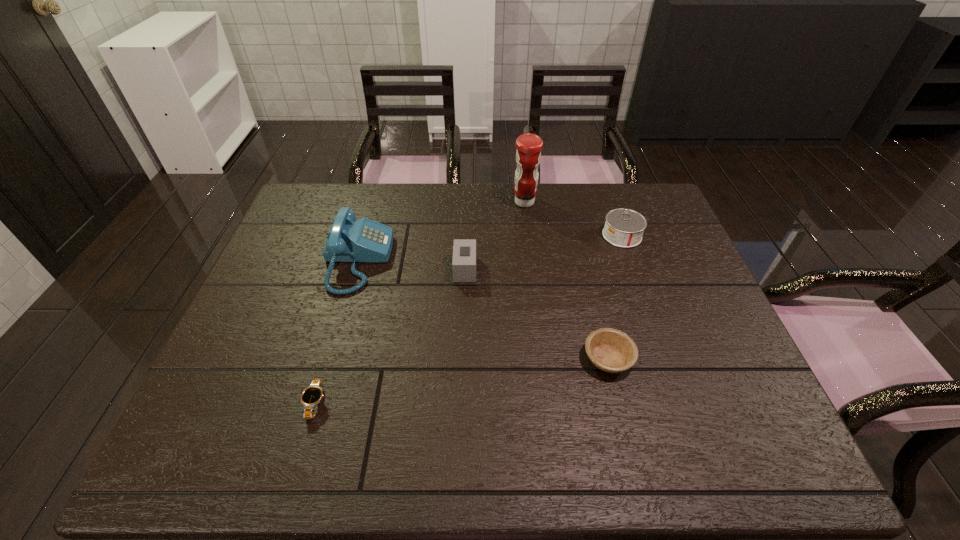
Where is `the farthest object`? the farthest object is located at coordinates (528, 155).

You are a GUI agent. You are given a task and a screenshot of the screen. Output one action in this format:
    pyautogui.click(x=<x>, y=<y>)
    Task: Click on the tallest object
    The height and width of the screenshot is (540, 960).
    Given the screenshot: What is the action you would take?
    pyautogui.click(x=528, y=155)

At what (x,y) coordinates should I click in order to perform the action: click on the second tallest object. Please return your answer as a coordinate pair (x, y). Looking at the image, I should click on (364, 240).

Locate an element on the screen. Image resolution: width=960 pixels, height=540 pixels. alarm clock is located at coordinates (464, 250).

Identify the location of the rightmost object. (624, 228).

You are a GUI agent. You are given a task and a screenshot of the screen. Output one action in this format:
    pyautogui.click(x=<x>, y=<y>)
    Task: Click on the bowl
    The height and width of the screenshot is (540, 960).
    Given the screenshot: What is the action you would take?
    pyautogui.click(x=611, y=350)

This screenshot has height=540, width=960. I want to click on the second nearest object, so click(611, 350).

I want to click on the shortest object, so click(310, 398).

This screenshot has width=960, height=540. Find the location of `the nearest object`. the nearest object is located at coordinates (310, 398).

What are the coordinates of `blank space located on the left of the tallest object` in the screenshot? It's located at (494, 202).